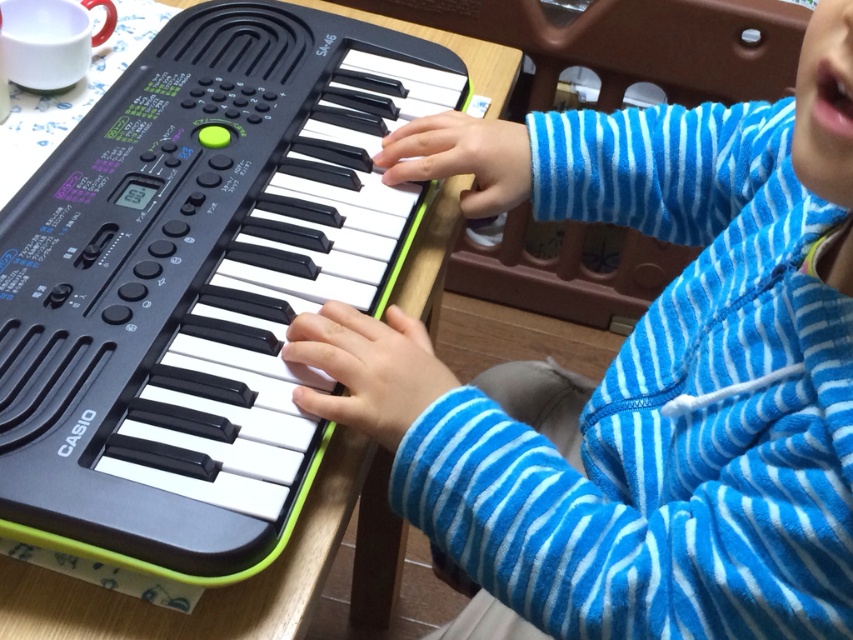
Question: Which point appears farthest from the camera in this image?

Choices:
 (A) (61, 412)
 (B) (680, 348)

Answer: (B)

Question: Is blue fleece sweater at center in front of black plastic keyboard at center?

Choices:
 (A) no
 (B) yes

Answer: (B)

Question: Which point is farther to the camera?

Choices:
 (A) blue fleece sweater at center
 (B) black plastic keyboard at center

Answer: (B)

Question: Among these points, which one is farthest from the camera?

Choices:
 (A) (613, 625)
 (B) (51, 237)

Answer: (B)

Question: Can you confirm if blue fleece sweater at center is wider than black plastic keyboard at center?

Choices:
 (A) no
 (B) yes

Answer: (B)

Question: Can you confirm if blue fleece sweater at center is positioned above black plastic keyboard at center?

Choices:
 (A) no
 (B) yes

Answer: (A)